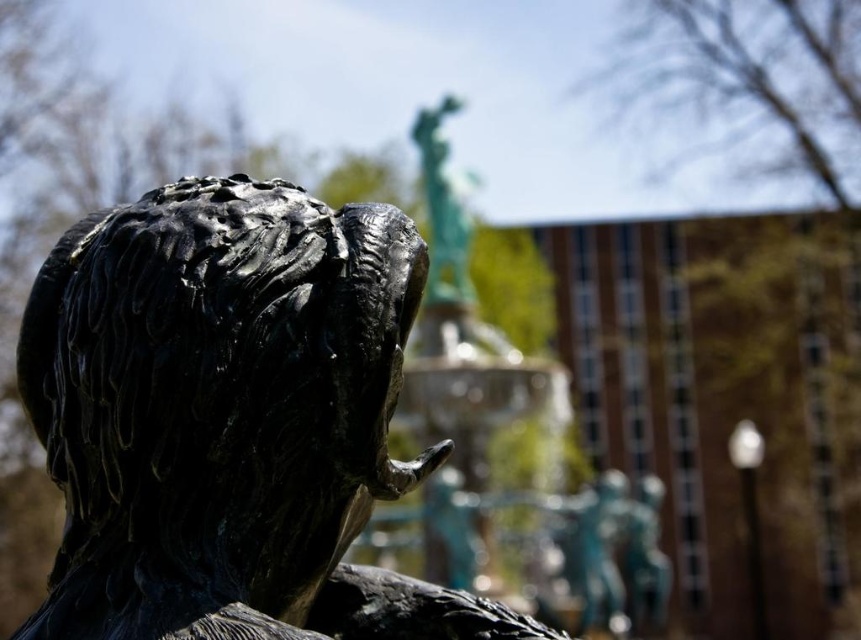
Question: From the image, what is the correct spatial relationship of shiny black statue at center in relation to green patina statue at upper center?

Choices:
 (A) left
 (B) right

Answer: (A)

Question: Which of the following is the farthest from the observer?

Choices:
 (A) shiny black statue at center
 (B) green patina statue at upper center

Answer: (B)

Question: Which point appears closest to the camera in this image?

Choices:
 (A) (454, 232)
 (B) (308, 365)

Answer: (B)

Question: Can you confirm if shiny black statue at center is thinner than green patina statue at upper center?

Choices:
 (A) no
 (B) yes

Answer: (A)

Question: Among these points, which one is farthest from the camera?

Choices:
 (A) (450, 250)
 (B) (227, 611)

Answer: (A)

Question: Does shiny black statue at center have a greater width compared to green patina statue at upper center?

Choices:
 (A) yes
 (B) no

Answer: (A)